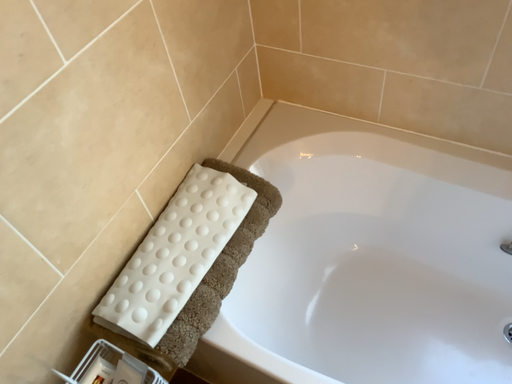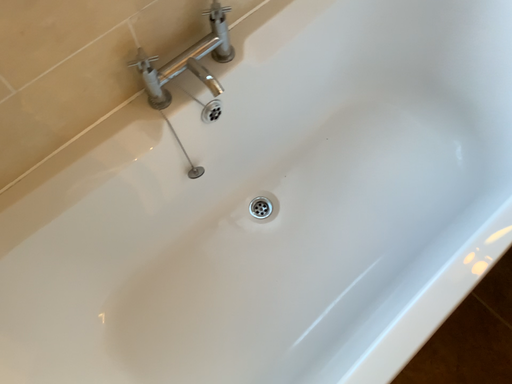
Question: Which way did the camera rotate in the video?

Choices:
 (A) rotated upward
 (B) rotated downward

Answer: (A)